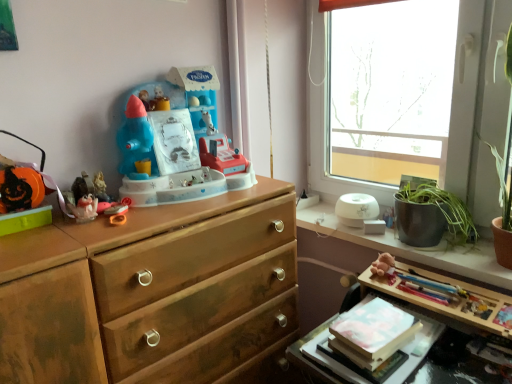
Question: Would you say transparent glass window at upper right is part of white glossy humidifier at upper right's contents?

Choices:
 (A) no
 (B) yes

Answer: (A)

Question: Does white glossy humidifier at upper right have a larger size compared to transparent glass window at upper right?

Choices:
 (A) no
 (B) yes

Answer: (A)

Question: Is white glossy humidifier at upper right far away from transparent glass window at upper right?

Choices:
 (A) no
 (B) yes

Answer: (A)

Question: From the image's perspective, is white glossy humidifier at upper right above transparent glass window at upper right?

Choices:
 (A) no
 (B) yes

Answer: (A)

Question: Does white glossy humidifier at upper right touch transparent glass window at upper right?

Choices:
 (A) yes
 (B) no

Answer: (B)

Question: In terms of size, does matte plastic figurine at left, which is the third toy in left-to-right order, appear bigger or smaller than matte plastic toy at left, acting as the second toy starting from the left?

Choices:
 (A) big
 (B) small

Answer: (B)

Question: Would you say matte plastic figurine at left, acting as the 2th toy starting from the right, is inside or outside matte plastic toy at left, which is the 3th toy from right to left?

Choices:
 (A) inside
 (B) outside

Answer: (B)

Question: Considering the positions of matte plastic figurine at left, acting as the 2th toy starting from the right, and matte plastic toy at left, which is the 3th toy from right to left, in the image, is matte plastic figurine at left, acting as the 2th toy starting from the right, wider or thinner than matte plastic toy at left, which is the 3th toy from right to left,?

Choices:
 (A) thin
 (B) wide

Answer: (A)

Question: From the image's perspective, is matte plastic figurine at left, which is the third toy in left-to-right order, located above or below matte plastic toy at left, which is the 3th toy from right to left?

Choices:
 (A) above
 (B) below

Answer: (A)

Question: In terms of size, does matte plastic toy at left, acting as the second toy starting from the left, appear bigger or smaller than brown plush toy at upper right?

Choices:
 (A) small
 (B) big

Answer: (B)

Question: In terms of height, does matte plastic toy at left, which is the 3th toy from right to left, look taller or shorter compared to brown plush toy at upper right?

Choices:
 (A) short
 (B) tall

Answer: (B)

Question: Considering their positions, is matte plastic toy at left, acting as the second toy starting from the left, located in front of or behind brown plush toy at upper right?

Choices:
 (A) front
 (B) behind

Answer: (A)

Question: Considering the positions of matte plastic toy at left, which is the 3th toy from right to left, and brown plush toy at upper right in the image, is matte plastic toy at left, which is the 3th toy from right to left, wider or thinner than brown plush toy at upper right?

Choices:
 (A) thin
 (B) wide

Answer: (A)

Question: Is point [489, 316] positioned closer to the camera than point [79, 221]?

Choices:
 (A) farther
 (B) closer

Answer: (A)

Question: Is wooden table at lower right in front of or behind matte plastic toy at left, acting as the second toy starting from the left, in the image?

Choices:
 (A) behind
 (B) front

Answer: (B)